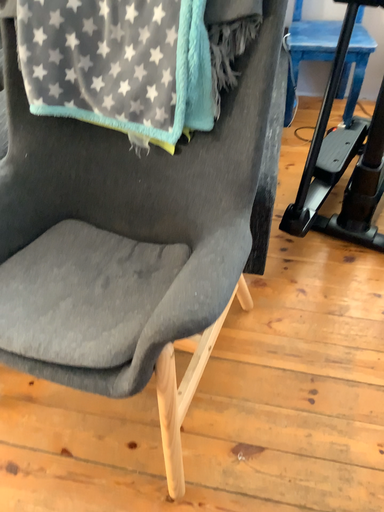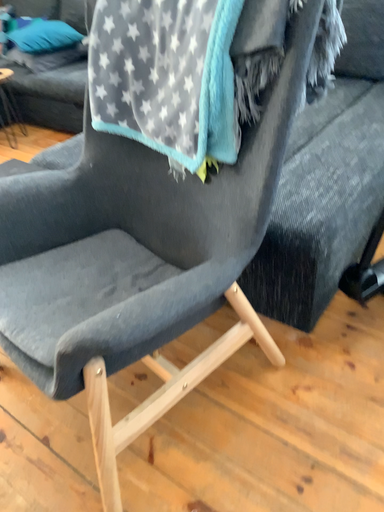
Question: Which way did the camera rotate in the video?

Choices:
 (A) rotated right
 (B) rotated left

Answer: (B)